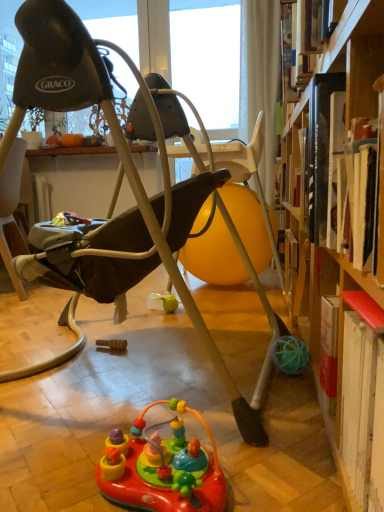
You are a GUI agent. You are given a task and a screenshot of the screen. Output one action in this format:
    pyautogui.click(x=<x>, y=<y>)
    Task: Click on the vacant space situated on the left part of multicolored plastic toy at center
    
    Given the screenshot: What is the action you would take?
    coord(49,459)